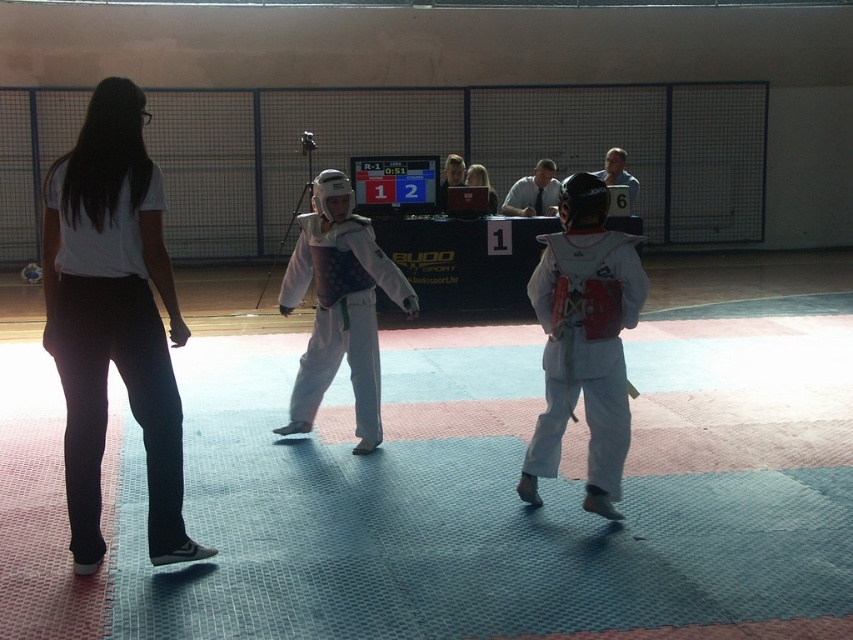
Where is `white matte karate uniform at center`? The height and width of the screenshot is (640, 853). white matte karate uniform at center is located at coordinates (584, 340).

What do you see at coordinates (584, 340) in the screenshot?
I see `white matte karate uniform at center` at bounding box center [584, 340].

At what (x,y) coordinates should I click in order to perform the action: click on white matte karate uniform at center. Please return your answer as a coordinate pair (x, y). This screenshot has height=640, width=853. Looking at the image, I should click on (584, 340).

Between white matte pants at left and white matte karate uniform at center, which one has more height?

white matte pants at left is taller.

Is white matte pants at left closer to the viewer compared to white matte karate uniform at center?

Yes.

What do you see at coordinates (113, 317) in the screenshot? The width and height of the screenshot is (853, 640). I see `white matte pants at left` at bounding box center [113, 317].

Locate an element on the screen. The image size is (853, 640). white matte pants at left is located at coordinates (113, 317).

Does point (91, 445) lie behind point (363, 296)?

No, it is not.

Identify the location of white matte pants at left. This screenshot has height=640, width=853. (113, 317).

Identify the location of white matte pants at left. 113,317.